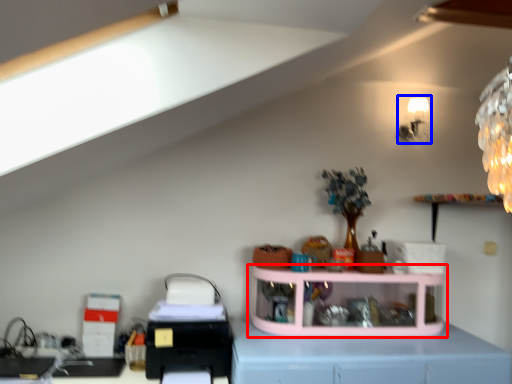
Question: Which of the following is the farthest to the observer, shelf (highlighted by a red box) or lamp (highlighted by a blue box)?

Choices:
 (A) shelf
 (B) lamp

Answer: (B)